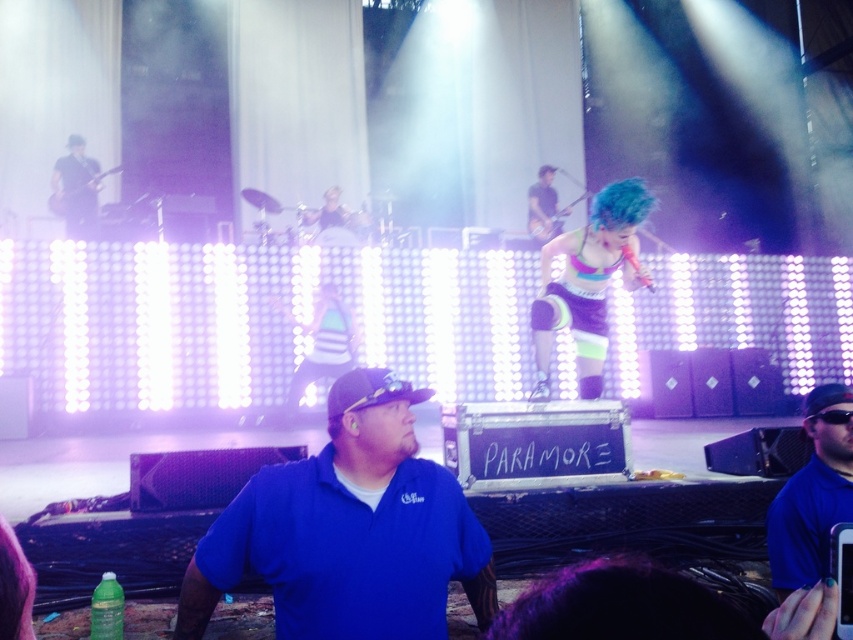
Question: Which of the following is the closest to the observer?

Choices:
 (A) (793, 493)
 (B) (80, 164)

Answer: (A)

Question: Among these points, which one is farthest from the camera?

Choices:
 (A) (350, 486)
 (B) (630, 257)
 (C) (846, 509)
 (D) (61, 179)

Answer: (D)

Question: Considering the relative positions of blue cotton shirt at center and blue shirt at lower right in the image provided, where is blue cotton shirt at center located with respect to blue shirt at lower right?

Choices:
 (A) right
 (B) left

Answer: (B)

Question: Can you confirm if blue cotton shirt at center is positioned to the right of neon blue hair at center?

Choices:
 (A) yes
 (B) no

Answer: (B)

Question: Which is farther from the blue shirt at lower right?

Choices:
 (A) blue cotton shirt at center
 (B) matte black guitar at upper left
 (C) neon blue hair at center

Answer: (B)

Question: Can you confirm if blue cotton shirt at center is smaller than blue shirt at lower right?

Choices:
 (A) no
 (B) yes

Answer: (A)